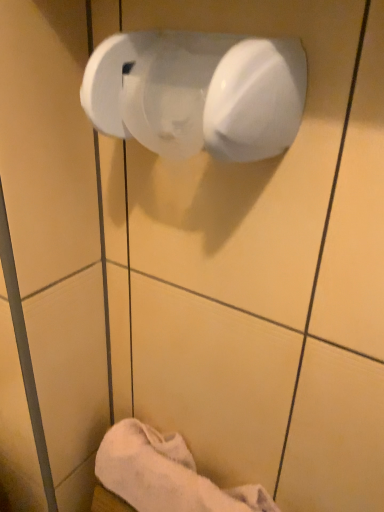
Question: Is white fluffy towel at lower left in front of white glossy toilet paper at upper center?

Choices:
 (A) yes
 (B) no

Answer: (B)

Question: Is white fluffy towel at lower left to the right of white glossy toilet paper at upper center from the viewer's perspective?

Choices:
 (A) no
 (B) yes

Answer: (A)

Question: Does white fluffy towel at lower left have a greater height compared to white glossy toilet paper at upper center?

Choices:
 (A) no
 (B) yes

Answer: (B)

Question: Can you confirm if white fluffy towel at lower left is shorter than white glossy toilet paper at upper center?

Choices:
 (A) yes
 (B) no

Answer: (B)

Question: Can you see white fluffy towel at lower left touching white glossy toilet paper at upper center?

Choices:
 (A) no
 (B) yes

Answer: (A)

Question: Considering the relative sizes of white fluffy towel at lower left and white glossy toilet paper at upper center in the image provided, is white fluffy towel at lower left smaller than white glossy toilet paper at upper center?

Choices:
 (A) yes
 (B) no

Answer: (B)

Question: Is white glossy toilet paper at upper center shorter than white fluffy towel at lower left?

Choices:
 (A) yes
 (B) no

Answer: (A)

Question: Is white glossy toilet paper at upper center bigger than white fluffy towel at lower left?

Choices:
 (A) yes
 (B) no

Answer: (B)

Question: Would you say white glossy toilet paper at upper center is outside white fluffy towel at lower left?

Choices:
 (A) yes
 (B) no

Answer: (A)

Question: Could you tell me if white glossy toilet paper at upper center is turned towards white fluffy towel at lower left?

Choices:
 (A) yes
 (B) no

Answer: (B)

Question: Does white glossy toilet paper at upper center have a greater width compared to white fluffy towel at lower left?

Choices:
 (A) yes
 (B) no

Answer: (B)

Question: Is white glossy toilet paper at upper center positioned with its back to white fluffy towel at lower left?

Choices:
 (A) yes
 (B) no

Answer: (B)

Question: Is point (165, 44) positioned closer to the camera than point (119, 433)?

Choices:
 (A) closer
 (B) farther

Answer: (A)